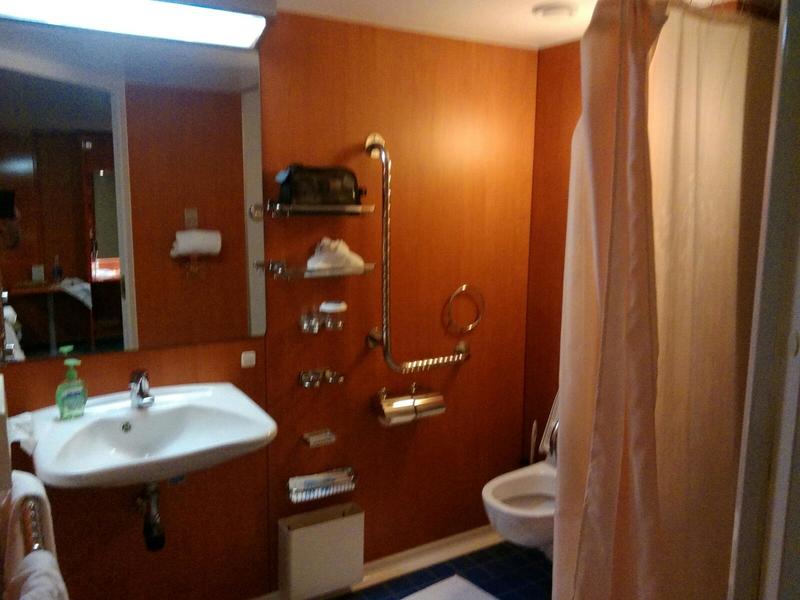
In order to click on chrome toilet roll holder in this screenshot , I will do `click(404, 403)`.